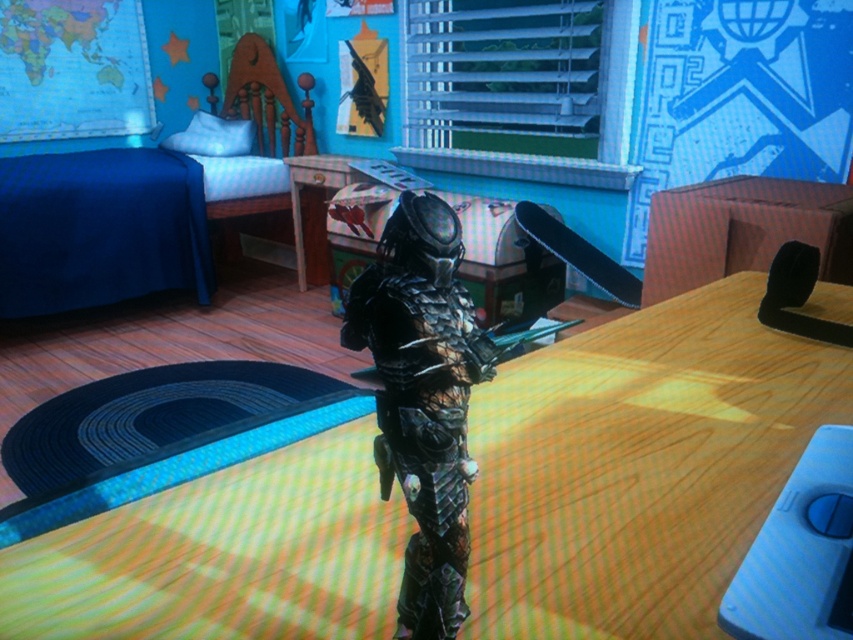
Is point (624, 612) positioned before point (410, 413)?

No, (624, 612) is further to viewer.

Is metallic silver table at center taller than metallic black armor at center?

Correct, metallic silver table at center is much taller as metallic black armor at center.

Which is behind, point (735, 388) or point (403, 436)?

The point (735, 388) is more distant.

The height and width of the screenshot is (640, 853). Identify the location of metallic silver table at center. (639, 467).